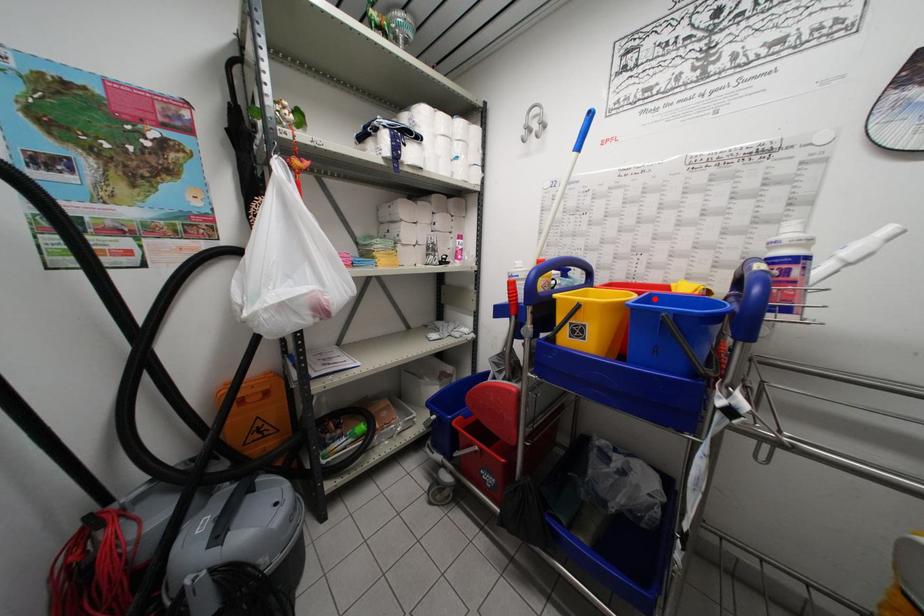
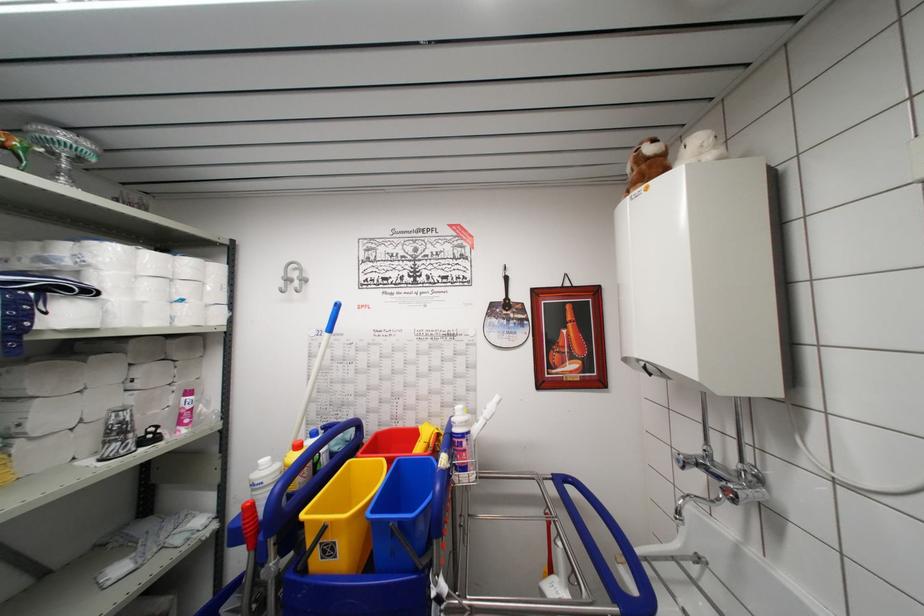
Locate, in the second image, the point that corresponds to the highlighted location in the first image.

(402, 466)